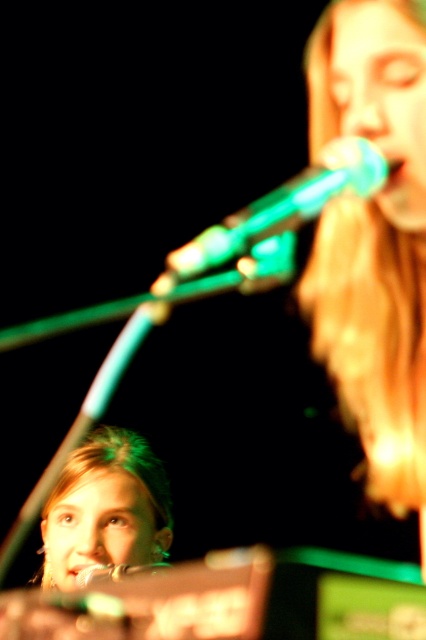
Can you confirm if shiny gold microphone at upper right is taller than blonde hair at lower left?

Correct, shiny gold microphone at upper right is much taller as blonde hair at lower left.

In the scene shown: Is shiny gold microphone at upper right below blonde hair at lower left?

Incorrect, shiny gold microphone at upper right is not positioned below blonde hair at lower left.

Which is in front, point (331, 333) or point (149, 483)?

Point (331, 333)

I want to click on shiny gold microphone at upper right, so pyautogui.click(x=374, y=241).

Can you confirm if blonde hair at lower left is positioned below green metallic microphone at center?

A: Yes, blonde hair at lower left is below green metallic microphone at center.

Consider the image. Which is more to the left, blonde hair at lower left or green metallic microphone at center?

blonde hair at lower left is more to the left.

Between point (131, 468) and point (356, 150), which one is positioned in front?

Point (356, 150) is more forward.

What are the coordinates of `blonde hair at lower left` in the screenshot? It's located at (106, 508).

Can you confirm if shiny gold microphone at upper right is taller than green metallic microphone at center?

Yes, shiny gold microphone at upper right is taller than green metallic microphone at center.

Who is positioned more to the right, shiny gold microphone at upper right or green metallic microphone at center?

Positioned to the right is shiny gold microphone at upper right.

Describe the element at coordinates (374, 241) in the screenshot. I see `shiny gold microphone at upper right` at that location.

Where is `shiny gold microphone at upper right`? shiny gold microphone at upper right is located at coordinates (374, 241).